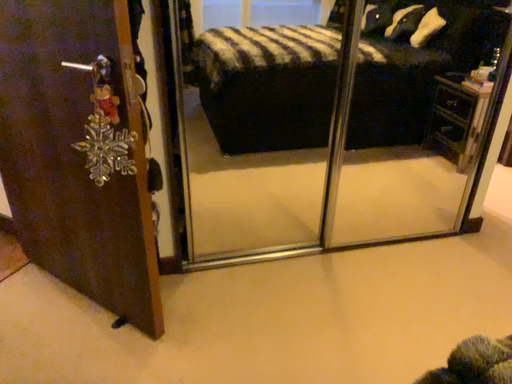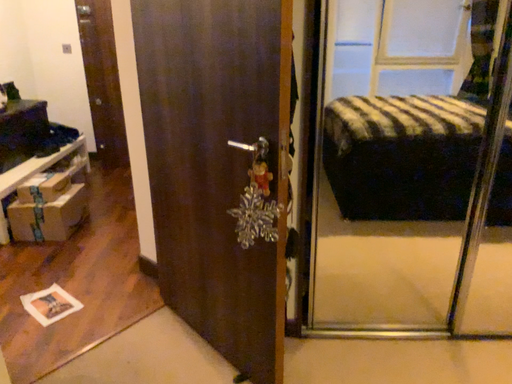
Question: How did the camera likely rotate when shooting the video?

Choices:
 (A) rotated right
 (B) rotated left

Answer: (B)